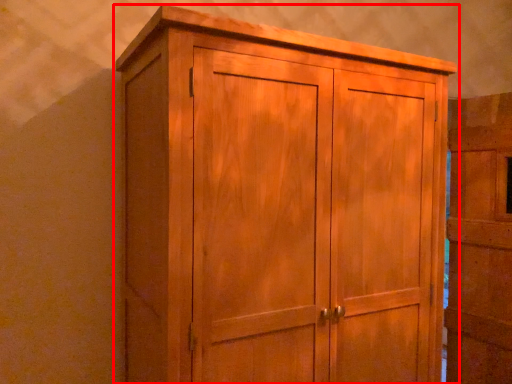
Question: Where is cupboard (annotated by the red box) located in relation to door in the image?

Choices:
 (A) left
 (B) right

Answer: (A)